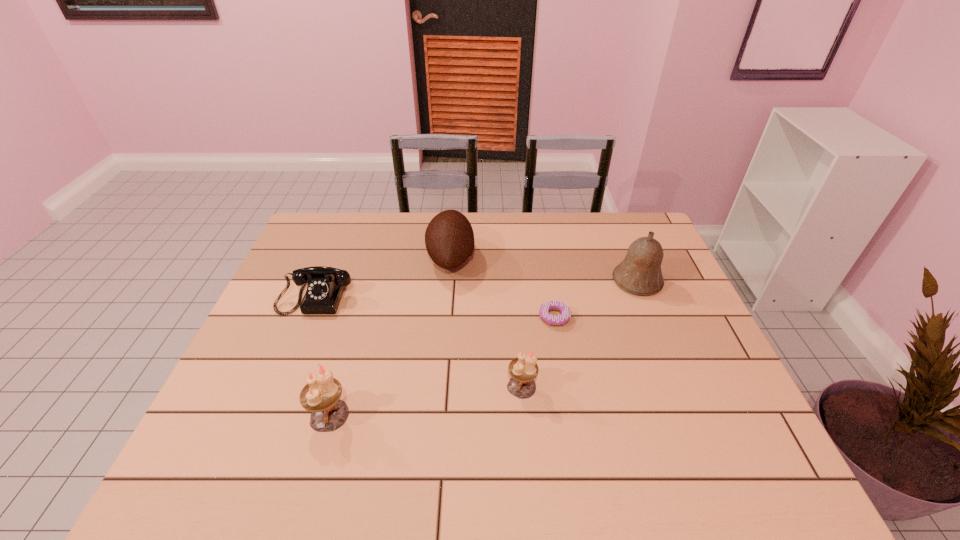
The width and height of the screenshot is (960, 540). In the image, there is a desktop. Identify the location of vacant space at the left edge. (272, 366).

The height and width of the screenshot is (540, 960). I want to click on free space at the right edge, so click(702, 392).

This screenshot has height=540, width=960. In the image, there is a desktop. What are the coordinates of `vacant space at the far right corner` in the screenshot? It's located at pos(649,228).

Where is `free spot between the shorter candle holder and the football`? free spot between the shorter candle holder and the football is located at coordinates (487, 322).

At what (x,y) coordinates should I click in order to perform the action: click on free space between the shortest object and the rightmost object. Please return your answer as a coordinate pair (x, y). Looking at the image, I should click on (596, 299).

What are the coordinates of `vacant point located between the left candle holder and the football` in the screenshot? It's located at (390, 336).

Locate an element on the screen. free space between the football and the bell is located at coordinates (544, 269).

Identify the location of vacant space that is in between the third object from left to right and the fifth tallest object. The width and height of the screenshot is (960, 540). (385, 276).

Where is `free spot between the second object from right to left and the football`? This screenshot has width=960, height=540. free spot between the second object from right to left and the football is located at coordinates (503, 288).

I want to click on empty space between the right candle holder and the rightmost object, so click(x=580, y=334).